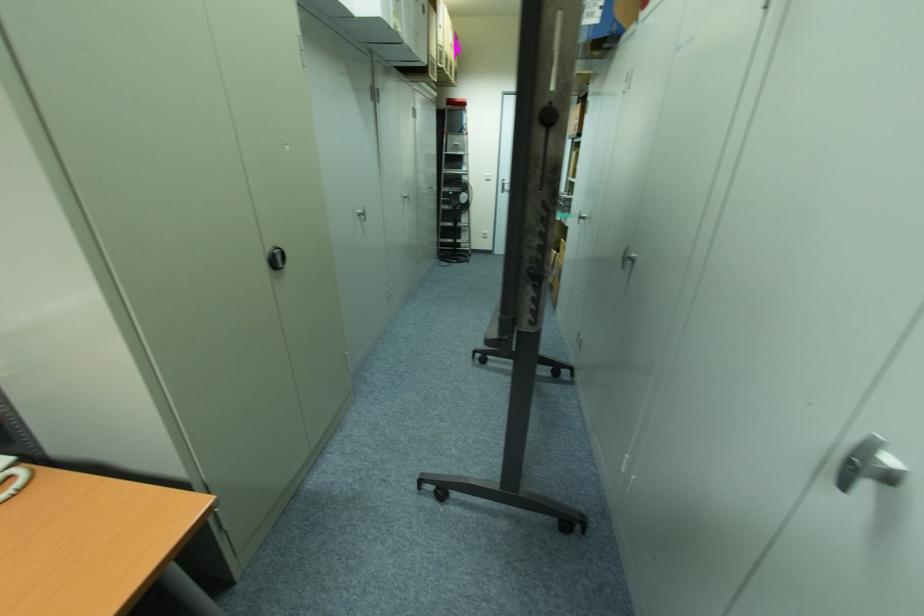
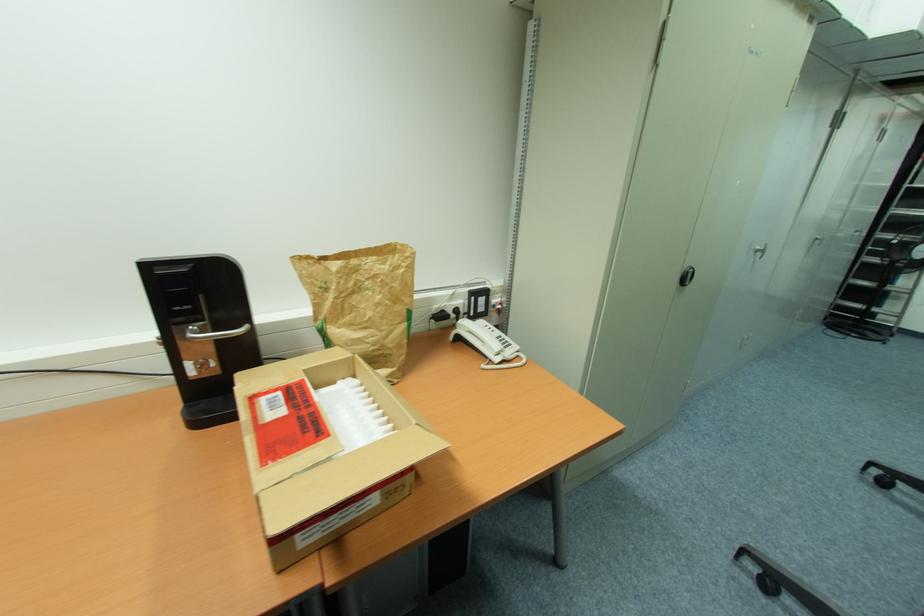
Question: Based on the continuous images, in which direction is the camera rotating? Reply with the corresponding letter.

Choices:
 (A) Left
 (B) Right
 (C) Up
 (D) Down

Answer: (A)